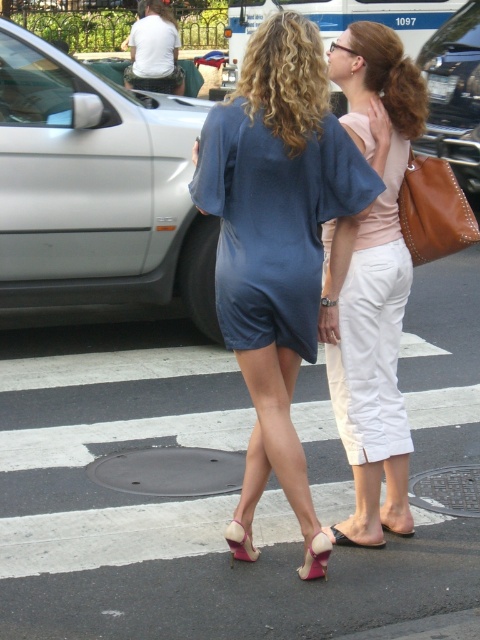
The height and width of the screenshot is (640, 480). Describe the element at coordinates (96, 188) in the screenshot. I see `silver metallic car at left` at that location.

Is point (50, 173) in front of point (228, 536)?

No.

This screenshot has width=480, height=640. In order to click on silver metallic car at left in this screenshot , I will do `click(96, 188)`.

From the picture: Who is positioned more to the left, silver metallic car at left or metallic silver van at center?

Positioned to the left is silver metallic car at left.

Is silver metallic car at left below metallic silver van at center?

Yes.

Image resolution: width=480 pixels, height=640 pixels. What are the coordinates of `silver metallic car at left` in the screenshot? It's located at (96, 188).

Who is taller, matte blue dress at center or metallic silver car at center?

metallic silver car at center

Is matte blue dress at center further to the viewer compared to metallic silver car at center?

No, it is not.

Measure the distance between matte blue dress at center and camera.

A distance of 11.68 feet exists between matte blue dress at center and camera.

Identify the location of matte blue dress at center. (278, 236).